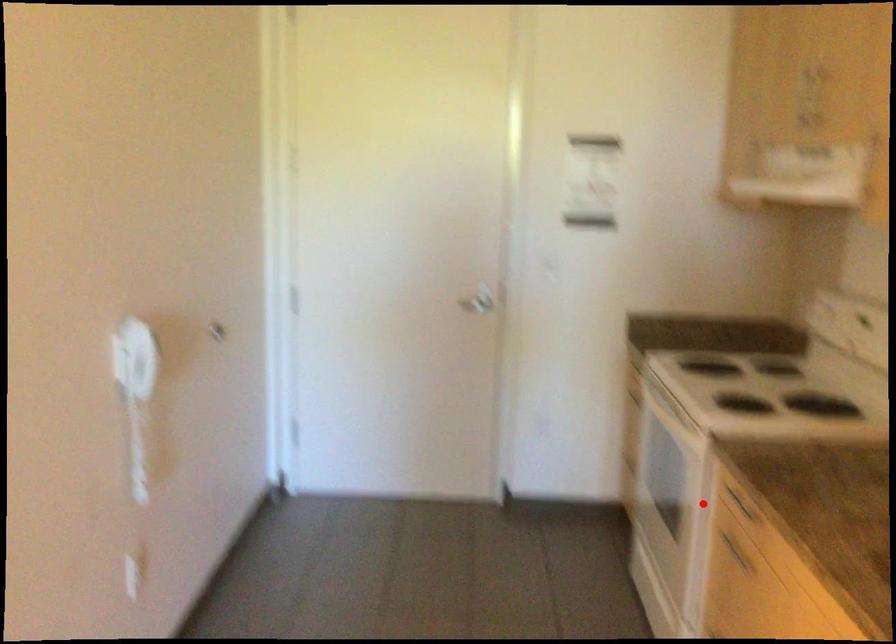
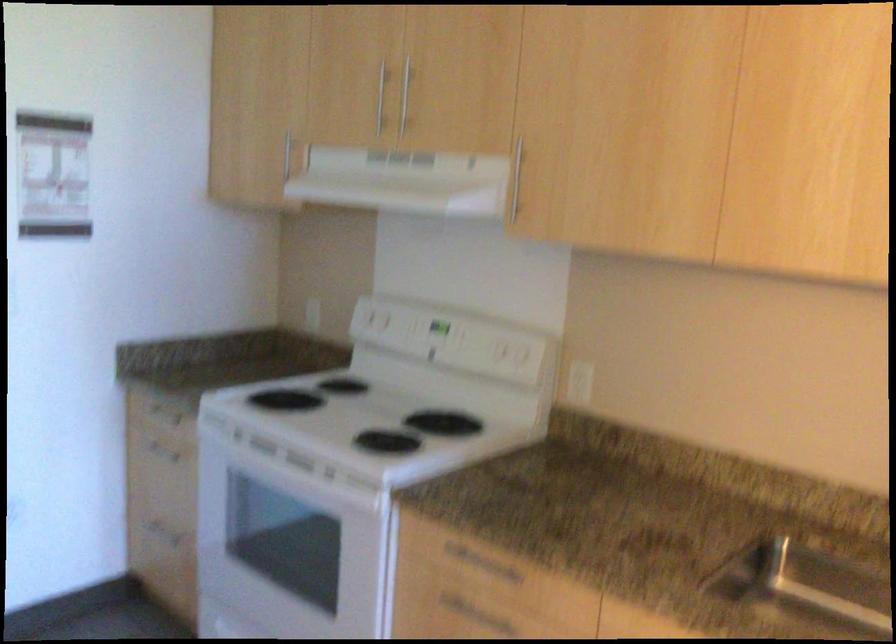
Find the pixel in the second image that matches the highlighted location in the first image.

(385, 571)